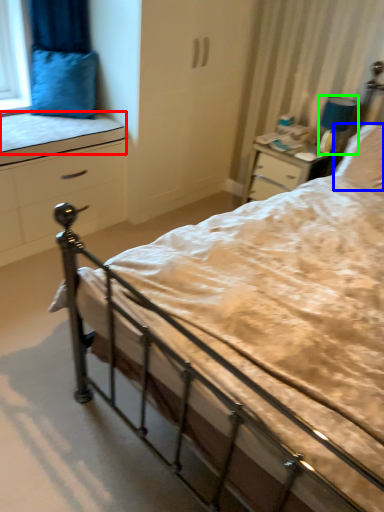
Question: Which object is positioned farthest from mattress (highlighted by a red box)? Select from pillow (highlighted by a blue box) and lamp (highlighted by a green box).

Choices:
 (A) pillow
 (B) lamp

Answer: (A)